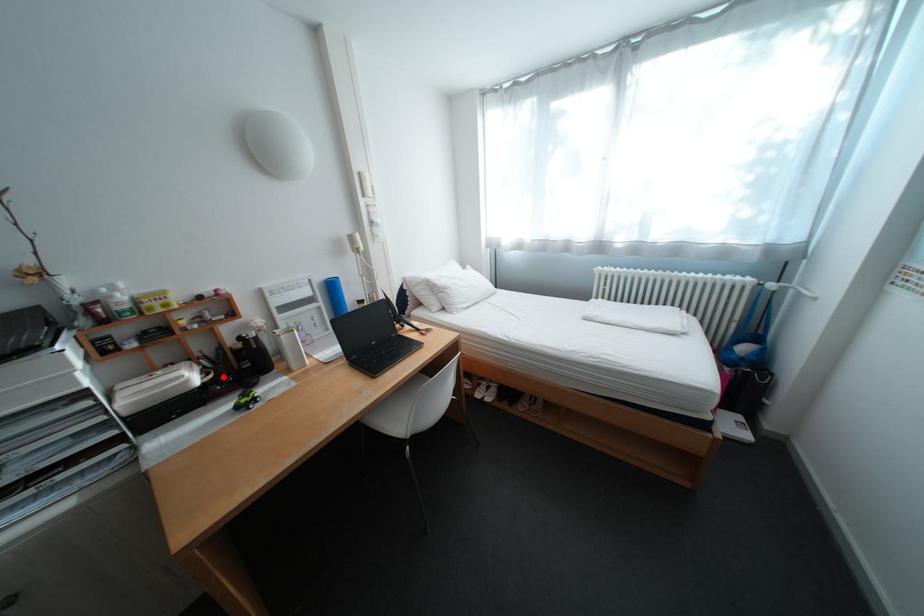
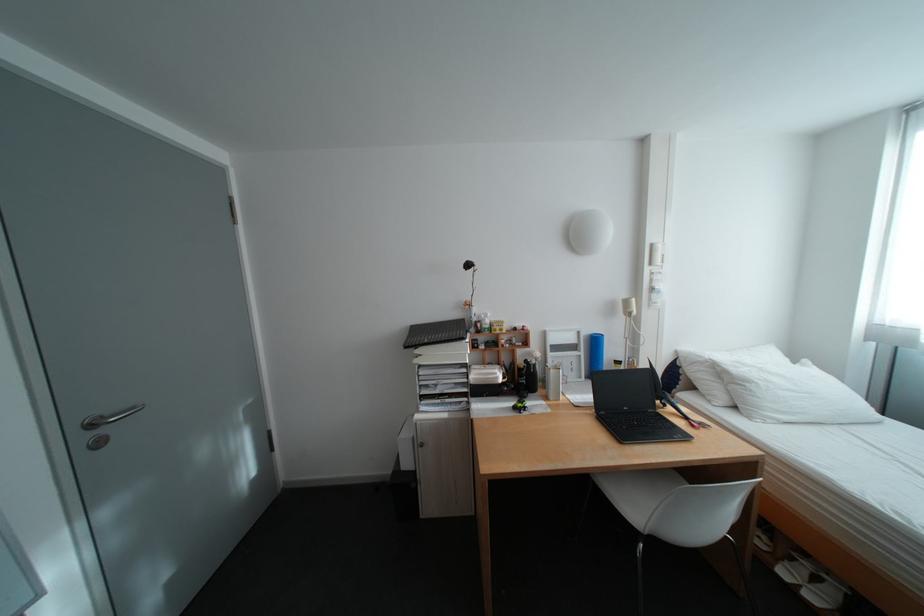
Find the pixel in the second image that matches the highlighted location in the first image.

(518, 381)